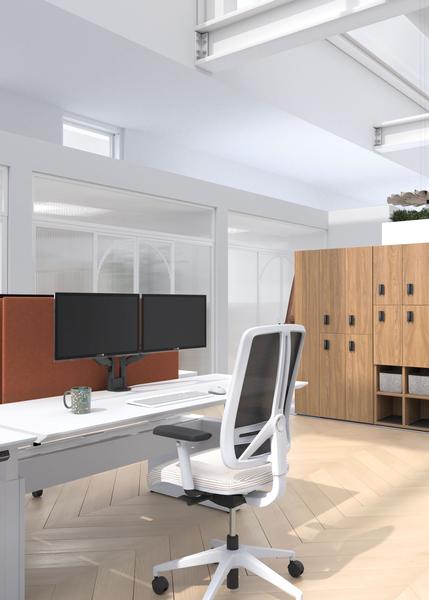
This screenshot has height=600, width=429. Find the location of `cabinet`. cabinet is located at coordinates point(359,290).